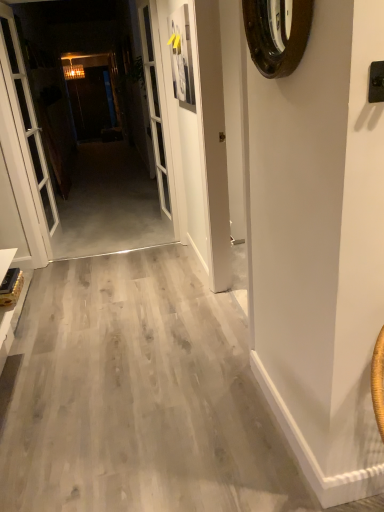
The width and height of the screenshot is (384, 512). In order to click on vacant space in concrete floor at center (from a real-world perspective) in this screenshot , I will do `click(113, 215)`.